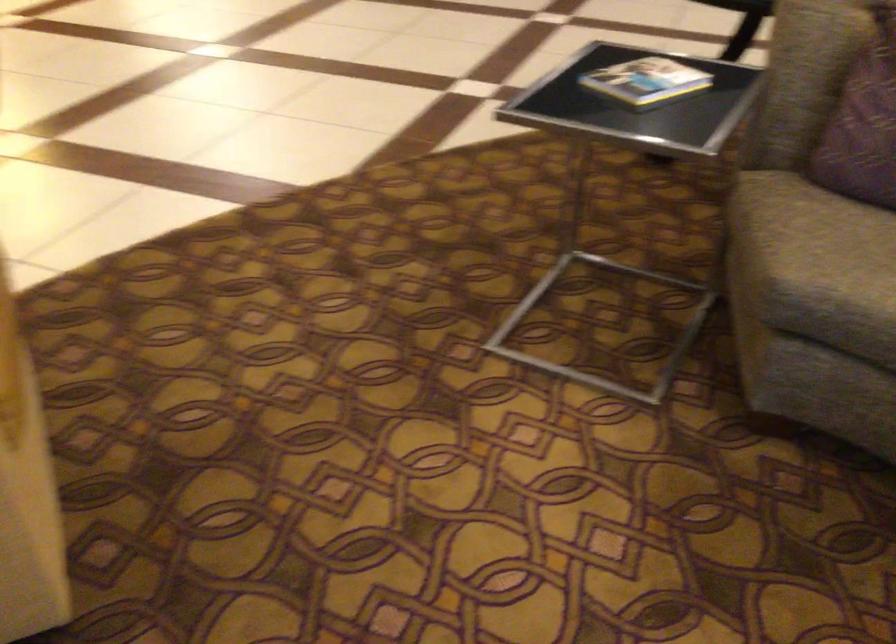
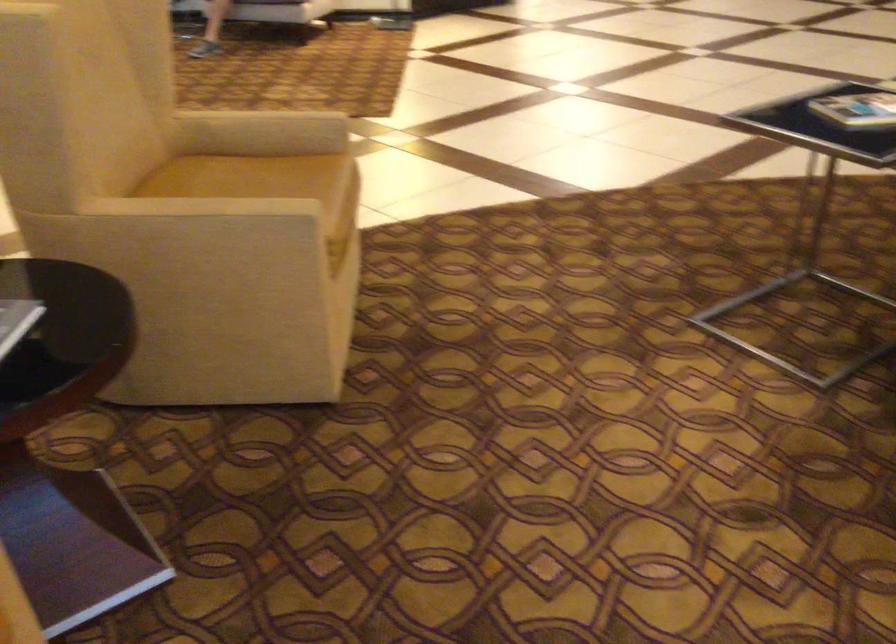
Looking at this image, the images are taken continuously from a first-person perspective. In which direction are you moving?

The cameraman moved toward right, backward.